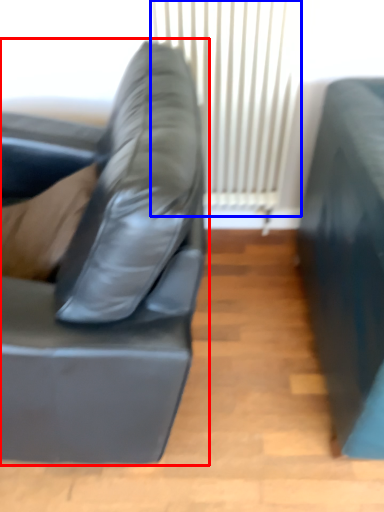
Question: Among these objects, which one is farthest to the camera, studio couch (highlighted by a red box) or curtain (highlighted by a blue box)?

Choices:
 (A) studio couch
 (B) curtain

Answer: (B)